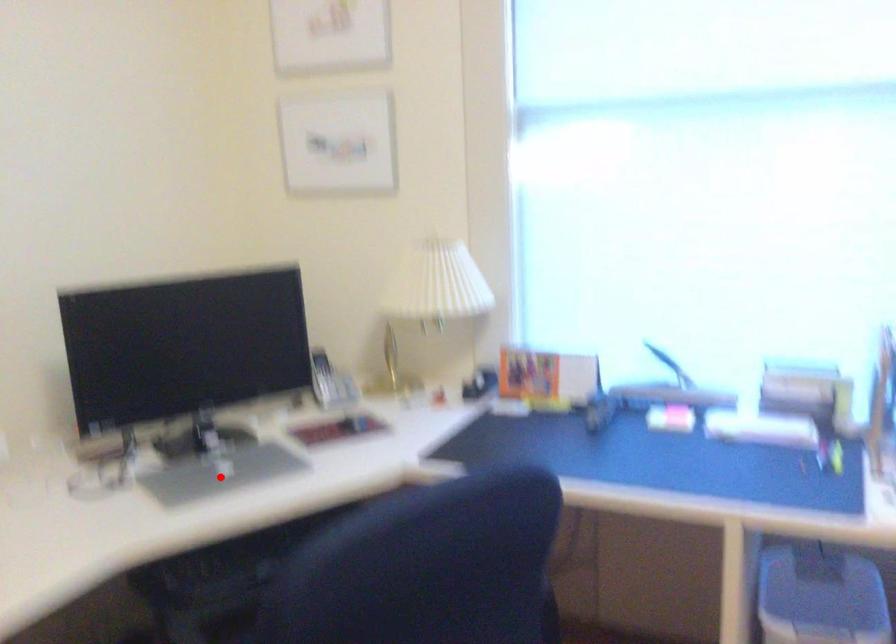
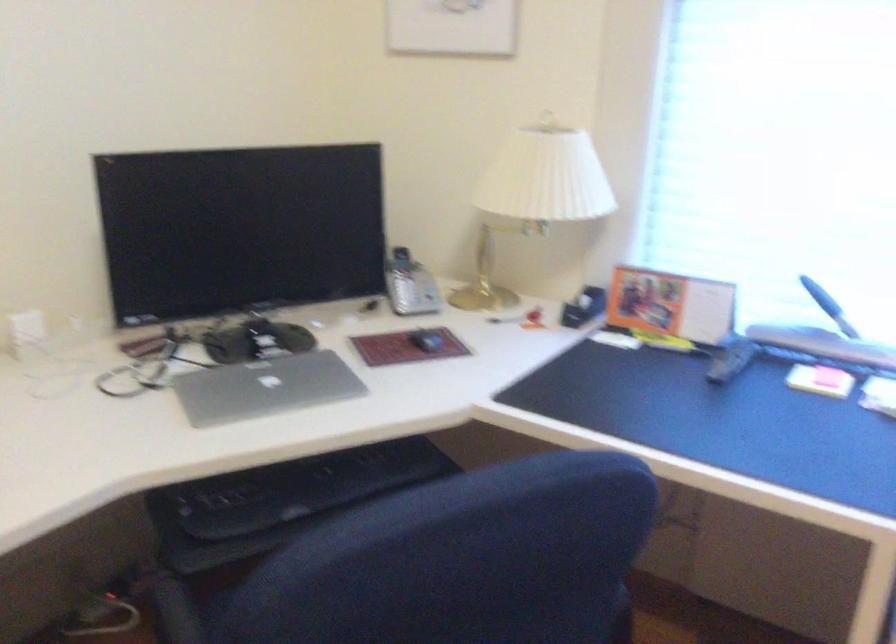
Locate, in the second image, the point that corresponds to the highlighted location in the first image.

(264, 386)